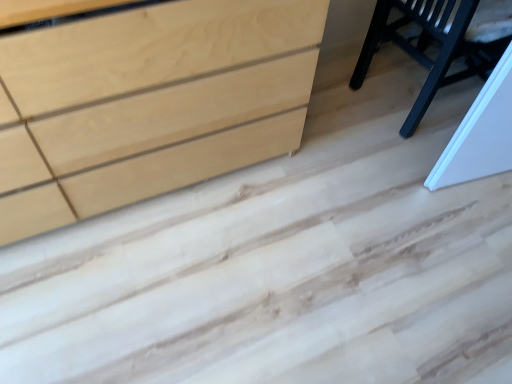
Question: Is glossy black chair at upper right in front of or behind natural wood chest of drawers at lower left in the image?

Choices:
 (A) behind
 (B) front

Answer: (A)

Question: From the image's perspective, is glossy black chair at upper right located above or below natural wood chest of drawers at lower left?

Choices:
 (A) above
 (B) below

Answer: (A)

Question: Looking at the image, does glossy black chair at upper right seem bigger or smaller compared to natural wood chest of drawers at lower left?

Choices:
 (A) big
 (B) small

Answer: (B)

Question: In terms of height, does natural wood chest of drawers at lower left look taller or shorter compared to glossy black chair at upper right?

Choices:
 (A) short
 (B) tall

Answer: (B)

Question: Relative to glossy black chair at upper right, is natural wood chest of drawers at lower left in front or behind?

Choices:
 (A) front
 (B) behind

Answer: (A)

Question: From a real-world perspective, is natural wood chest of drawers at lower left above or below glossy black chair at upper right?

Choices:
 (A) above
 (B) below

Answer: (A)

Question: Visually, is natural wood chest of drawers at lower left positioned to the left or to the right of glossy black chair at upper right?

Choices:
 (A) right
 (B) left

Answer: (B)